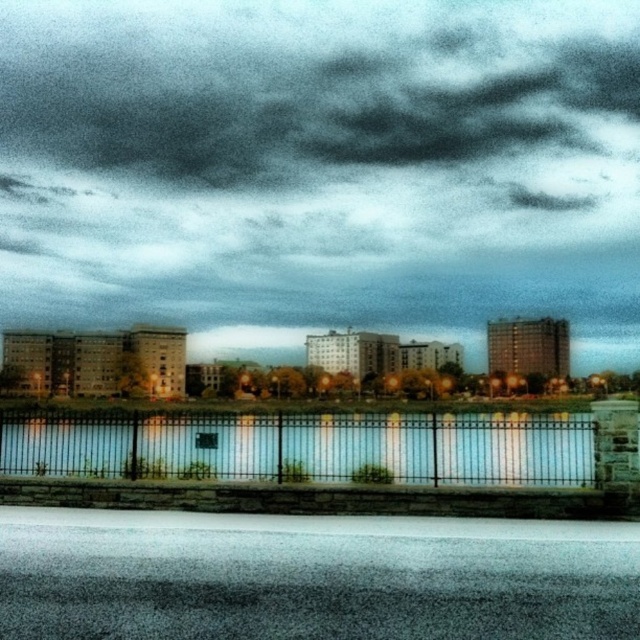
Can you confirm if dark gray cloud at upper center is positioned to the right of black metal fence at center?

Indeed, dark gray cloud at upper center is positioned on the right side of black metal fence at center.

Is dark gray cloud at upper center shorter than black metal fence at center?

Incorrect, dark gray cloud at upper center's height does not fall short of black metal fence at center's.

The height and width of the screenshot is (640, 640). What do you see at coordinates (321, 170) in the screenshot? I see `dark gray cloud at upper center` at bounding box center [321, 170].

At what (x,y) coordinates should I click in order to perform the action: click on dark gray cloud at upper center. Please return your answer as a coordinate pair (x, y). Looking at the image, I should click on (321, 170).